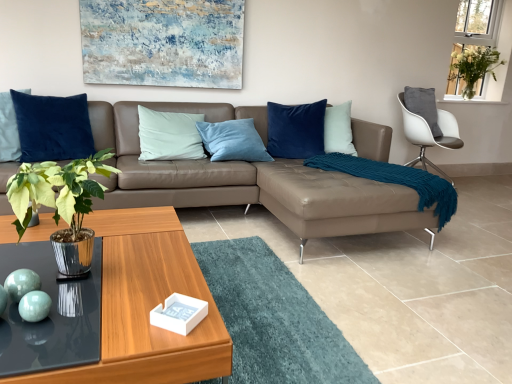
Find the location of a particular element. free spot behind shiny metallic plant at center-left is located at coordinates (132, 238).